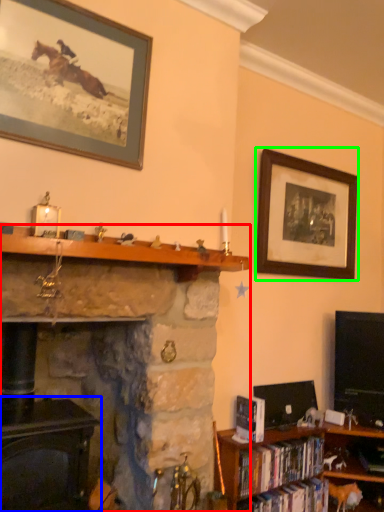
Question: Which object is positioned closest to fireplace (highlighted by a red box)? Select from fireplace (highlighted by a blue box) and picture frame (highlighted by a green box).

Choices:
 (A) fireplace
 (B) picture frame

Answer: (A)